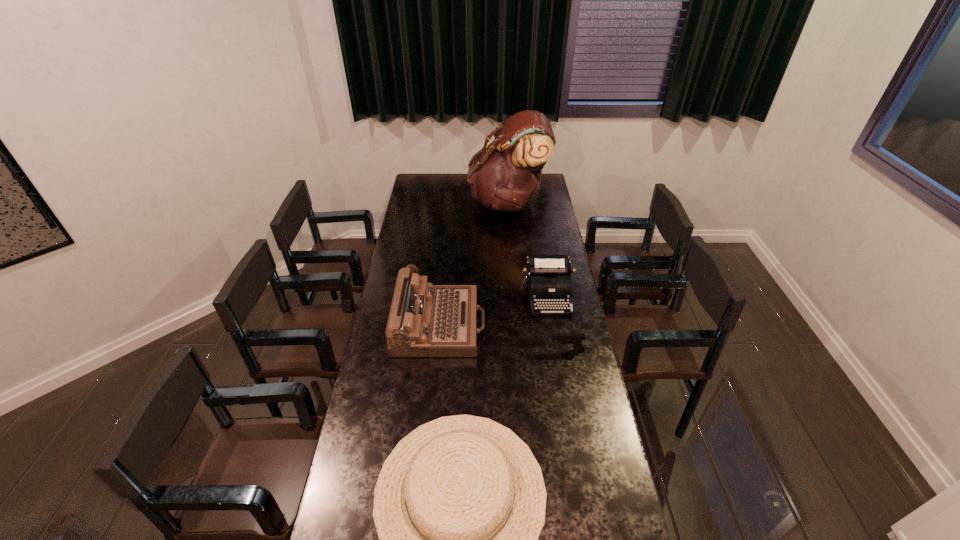
Locate an element on the screen. This screenshot has width=960, height=540. vacant region between the pistol and the taller typewriter is located at coordinates (503, 337).

Choose which object is the second nearest neighbor to the right typewriter. Please provide its 2D coordinates. Your answer should be formatted as a tuple, i.e. [(x, y)], where the tuple contains the x and y coordinates of a point satisfying the conditions above.

[(576, 339)]

The width and height of the screenshot is (960, 540). Identify the location of the third closest object relative to the pistol. (459, 504).